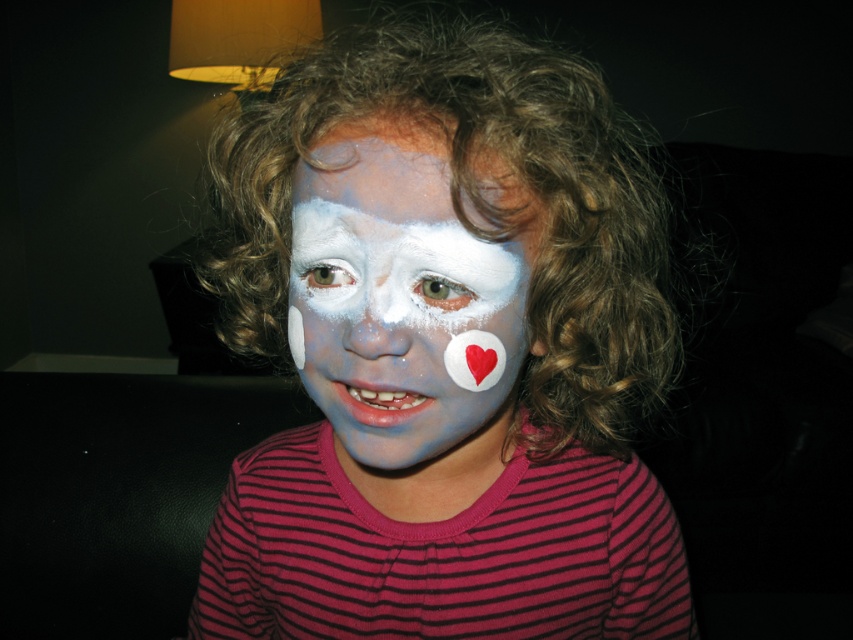
You are a photographer setting up for a child photoshoot. You notice the white matte face paint at center and the white matte nose at center. Which one do you need to adjust your camera focus on first if you want to capture both details clearly?

The white matte face paint at center is bigger than the white matte nose at center, so you should focus on the white matte face paint at center first to ensure its clarity before adjusting for the smaller nose.

You are a photographer adjusting your camera to capture the child in the image. The camera has a focus range of 12 inches. Can you focus on the white matte face paint at center without moving the camera?

The white matte face paint at center is 12.29 inches from viewer, which is slightly beyond the camera focus range of 12 inches. Therefore, the camera cannot focus on the white matte face paint at center without moving closer.

You are a photographer setting up a closeup shot of the child in the image. You need to ensure both the curly brown hair at center and the white matte nose at center are fully visible in the frame. Given that the camera lens has a fixed focal length, which object should you prioritize keeping centered to avoid cropping either one?

The curly brown hair at center has a larger width than the white matte nose at center, so prioritizing the curly brown hair at center to stay centered would ensure both objects remain fully visible without cropping.